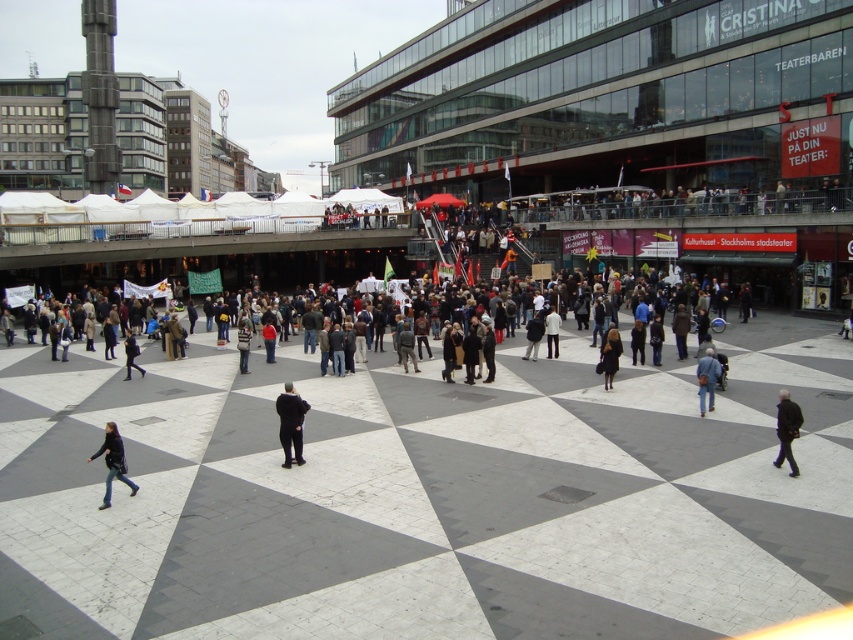
In the bustling urban square scene, there are two items of clothing visible. The denim jeans at lower left and the striped sweater at center. Which one is positioned more to the right from the observer perspective?

The denim jeans at lower left are positioned to the right of the striped sweater at center, so the denim jeans at lower left are more to the right.

You are standing in the bustling urban square and want to move from the point at coordinates (x=554, y=337) to the point at (x=126, y=358). Which direction should you move relative to your current position?

You should move downward because point (x=554, y=337) is in front of point (x=126, y=358), meaning the destination is behind you.

You are standing at the center of the urban square and want to find the denim jeans at lower left located at point [113,461]. Which direction should you move to reach it?

The denim jeans at lower left is located at point [113,461]. Since lower left implies a position below and to the left of the center, you should move southwest to reach it.